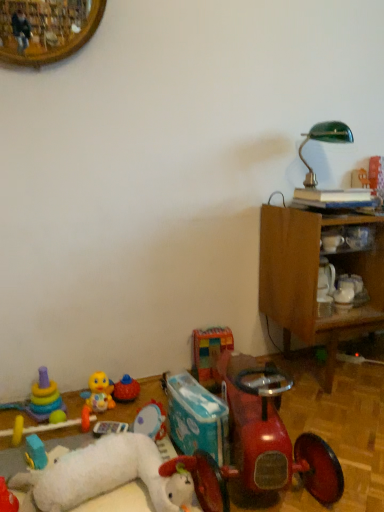
In order to click on teal rubber toy at lower left, placed as the third toy when sorted from left to right in this screenshot , I will do `click(35, 452)`.

What do you see at coordinates (7, 498) in the screenshot?
I see `rubber duck at lower left, which is the 10th toy in right-to-left order` at bounding box center [7, 498].

The image size is (384, 512). What do you see at coordinates (347, 239) in the screenshot?
I see `wooden shelf at right` at bounding box center [347, 239].

This screenshot has width=384, height=512. What do you see at coordinates (106, 475) in the screenshot?
I see `white plush toy at lower left, the 6th toy viewed from the left` at bounding box center [106, 475].

Find the location of `teal rubber toy at lower left, placed as the eighth toy when sorted from right to left`. teal rubber toy at lower left, placed as the eighth toy when sorted from right to left is located at coordinates (35, 452).

Which is closer, [1,498] or [34,444]?

The point [1,498] is closer to the camera.

Is rubber duck at lower left, which is the 1th toy in left-to-right order, taller than teal rubber toy at lower left, placed as the third toy when sorted from left to right?

Yes.

From a real-world perspective, which is physically below, rubber duck at lower left, which is the 10th toy in right-to-left order, or teal rubber toy at lower left, placed as the eighth toy when sorted from right to left?

From a 3D spatial view, teal rubber toy at lower left, placed as the eighth toy when sorted from right to left, is below.

Can you see rubber duck at lower left, which is the 10th toy in right-to-left order, touching teal rubber toy at lower left, placed as the eighth toy when sorted from right to left?

rubber duck at lower left, which is the 10th toy in right-to-left order, is not next to teal rubber toy at lower left, placed as the eighth toy when sorted from right to left, and they're not touching.

Between rubber duck at lower left, which is the 1th toy in left-to-right order, and stacked plastic rings at lower left, which appears as the 2th toy when viewed from the left, which one appears on the left side from the viewer's perspective?

From the viewer's perspective, rubber duck at lower left, which is the 1th toy in left-to-right order, appears more on the left side.

Between rubber duck at lower left, which is the 10th toy in right-to-left order, and stacked plastic rings at lower left, the 9th toy from the right, which one has smaller size?

rubber duck at lower left, which is the 10th toy in right-to-left order.

Between rubber duck at lower left, which is the 10th toy in right-to-left order, and stacked plastic rings at lower left, which appears as the 2th toy when viewed from the left, which one has less height?

With less height is rubber duck at lower left, which is the 10th toy in right-to-left order.

Consider the image. Is the surface of rubber duck at lower left, which is the 1th toy in left-to-right order, in direct contact with stacked plastic rings at lower left, the 9th toy from the right?

rubber duck at lower left, which is the 1th toy in left-to-right order, and stacked plastic rings at lower left, the 9th toy from the right, are clearly separated.

Locate an element on the screen. toy behind the rubberized orange ball at center, the 7th toy positioned from the left is located at coordinates (210, 353).

Is multicolored fabric blocks at center, acting as the second toy starting from the right, aimed at rubberized orange ball at center, the 7th toy positioned from the left?

No, multicolored fabric blocks at center, acting as the second toy starting from the right, does not turn towards rubberized orange ball at center, the 7th toy positioned from the left.

Visually, is multicolored fabric blocks at center, acting as the second toy starting from the right, positioned to the left or to the right of rubberized orange ball at center, the 7th toy positioned from the left?

In the image, multicolored fabric blocks at center, acting as the second toy starting from the right, appears on the right side of rubberized orange ball at center, the 7th toy positioned from the left.

Which is closer, (222, 340) or (123, 383)?

Point (222, 340) is positioned closer to the camera compared to point (123, 383).

In the scene shown: How many degrees apart are the facing directions of rubberized orange ball at center, the 7th toy positioned from the left, and stacked plastic rings at lower left, the 9th toy from the right?

The facing directions of rubberized orange ball at center, the 7th toy positioned from the left, and stacked plastic rings at lower left, the 9th toy from the right, are 1.65 degrees apart.

Which is more to the right, rubberized orange ball at center, the 7th toy positioned from the left, or stacked plastic rings at lower left, the 9th toy from the right?

rubberized orange ball at center, the 7th toy positioned from the left.

Based on the photo, which of these two, rubberized orange ball at center, the 7th toy positioned from the left, or stacked plastic rings at lower left, the 9th toy from the right, is bigger?

stacked plastic rings at lower left, the 9th toy from the right.

Is rubberized orange ball at center, which ranks as the fourth toy in right-to-left order, aimed at stacked plastic rings at lower left, the 9th toy from the right?

No, rubberized orange ball at center, which ranks as the fourth toy in right-to-left order, does not turn towards stacked plastic rings at lower left, the 9th toy from the right.

Is there a large distance between rubberized orange ball at center, which ranks as the fourth toy in right-to-left order, and rubber duck at lower left, which is the 1th toy in left-to-right order?

rubberized orange ball at center, which ranks as the fourth toy in right-to-left order, is near rubber duck at lower left, which is the 1th toy in left-to-right order, not far away.

The height and width of the screenshot is (512, 384). In order to click on the 6th toy in front of the rubberized orange ball at center, the 7th toy positioned from the left, counting from the anchor's position in this screenshot , I will do `click(7, 498)`.

Which is correct: rubberized orange ball at center, the 7th toy positioned from the left, is inside rubber duck at lower left, which is the 1th toy in left-to-right order, or outside of it?

The correct answer is: outside.

Which object is thinner, rubberized orange ball at center, the 7th toy positioned from the left, or rubber duck at lower left, which is the 1th toy in left-to-right order?

rubberized orange ball at center, the 7th toy positioned from the left, is thinner.

Are wooden shelf at right and rubberized orange ball at center, which ranks as the fourth toy in right-to-left order, beside each other?

wooden shelf at right is not next to rubberized orange ball at center, which ranks as the fourth toy in right-to-left order, and they're not touching.

The height and width of the screenshot is (512, 384). I want to click on toy that is the 1st one when counting backward from the wooden shelf at right, so click(x=126, y=389).

Is wooden shelf at right bigger than rubberized orange ball at center, which ranks as the fourth toy in right-to-left order?

No.

Is point (335, 252) closer or farther from the camera than point (135, 381)?

Point (335, 252) is positioned closer to the camera compared to point (135, 381).

Looking at this image, who is taller, wooden cabinet at right or multicolored plastic stacking rings at lower left, the 7th toy viewed from the right?

With more height is wooden cabinet at right.

Is the surface of wooden cabinet at right in direct contact with multicolored plastic stacking rings at lower left, which is the 4th toy in left-to-right order?

There is a gap between wooden cabinet at right and multicolored plastic stacking rings at lower left, which is the 4th toy in left-to-right order.

Is multicolored plastic stacking rings at lower left, the 7th toy viewed from the right, at the back of wooden cabinet at right?

No, wooden cabinet at right is not facing the opposite direction of multicolored plastic stacking rings at lower left, the 7th toy viewed from the right.

You are a GUI agent. You are given a task and a screenshot of the screen. Output one action in this format:
    pyautogui.click(x=<x>, y=<y>)
    Task: Click on the 1st toy in front of the teal rubber toy at lower left, placed as the third toy when sorted from left to right, starting your count from the anchor
    Image resolution: width=384 pixels, height=512 pixels.
    Given the screenshot: What is the action you would take?
    pyautogui.click(x=7, y=498)

What are the coordinates of `toy on the left of stacked plastic rings at lower left, which appears as the 2th toy when viewed from the left` in the screenshot? It's located at click(x=7, y=498).

Considering their positions, is wooden shelf at right positioned further to rubberized orange ball at center, which ranks as the fourth toy in right-to-left order, than plush yellow duck at lower left, the sixth toy viewed from the right?

wooden shelf at right.

When comparing their distances from stacked plastic rings at lower left, the 9th toy from the right, does rubber duck at lower left, which is the 1th toy in left-to-right order, or teal rubber toy at lower left, placed as the third toy when sorted from left to right, seem further?

rubber duck at lower left, which is the 1th toy in left-to-right order, lies further to stacked plastic rings at lower left, the 9th toy from the right, than the other object.

Based on their spatial positions, is teal rubber toy at lower left, placed as the eighth toy when sorted from right to left, or white plush toy at lower left, the 6th toy viewed from the left, closer to stacked plastic rings at lower left, which appears as the 2th toy when viewed from the left?

teal rubber toy at lower left, placed as the eighth toy when sorted from right to left, lies closer to stacked plastic rings at lower left, which appears as the 2th toy when viewed from the left, than the other object.

When comparing their distances from rubberized red tricycle at lower center, positioned as the 1th toy in right-to-left order, does rubber duck at lower left, which is the 1th toy in left-to-right order, or multicolored plastic stacking rings at lower left, which is the 4th toy in left-to-right order, seem closer?

The object closer to rubberized red tricycle at lower center, positioned as the 1th toy in right-to-left order, is multicolored plastic stacking rings at lower left, which is the 4th toy in left-to-right order.

Estimate the real-world distances between objects in this image. Which object is closer to rubberized red tricycle at lower center, positioned as the 1th toy in right-to-left order, green glass table lamp at upper right or shiny red toy car at lower right?

shiny red toy car at lower right.

Based on their spatial positions, is plush yellow duck at lower left, the sixth toy viewed from the right, or green glass table lamp at upper right further from rubber duck at lower left, which is the 1th toy in left-to-right order?

green glass table lamp at upper right.

When comparing their distances from multicolored fabric blocks at center, acting as the second toy starting from the right, does plush white stuffed animal at lower left, acting as the third toy starting from the right, or green glass table lamp at upper right seem closer?

plush white stuffed animal at lower left, acting as the third toy starting from the right, lies closer to multicolored fabric blocks at center, acting as the second toy starting from the right, than the other object.

From the picture: From the image, which object appears to be farther from multicolored fabric blocks at center, which appears as the ninth toy when viewed from the left, multicolored plastic stacking rings at lower left, the 7th toy viewed from the right, or rubber duck at lower left, which is the 1th toy in left-to-right order?

Based on the image, rubber duck at lower left, which is the 1th toy in left-to-right order, appears to be further to multicolored fabric blocks at center, which appears as the ninth toy when viewed from the left.

The width and height of the screenshot is (384, 512). I want to click on toy car positioned between rubberized red tricycle at lower center, which ranks as the tenth toy in left-to-right order, and wooden shelf at right from near to far, so click(x=272, y=435).

Identify the location of shelf situated between rubberized orange ball at center, which ranks as the fourth toy in right-to-left order, and wooden cabinet at right from left to right. Image resolution: width=384 pixels, height=512 pixels. (347, 239).

Where is `shelf between green glass table lamp at upper right and rubberized red tricycle at lower center, which ranks as the tenth toy in left-to-right order, in the vertical direction`? shelf between green glass table lamp at upper right and rubberized red tricycle at lower center, which ranks as the tenth toy in left-to-right order, in the vertical direction is located at coordinates (347, 239).

Locate an element on the screen. This screenshot has height=512, width=384. table lamp located between rubber duck at lower left, which is the 10th toy in right-to-left order, and wooden cabinet at right in the left-right direction is located at coordinates (324, 141).